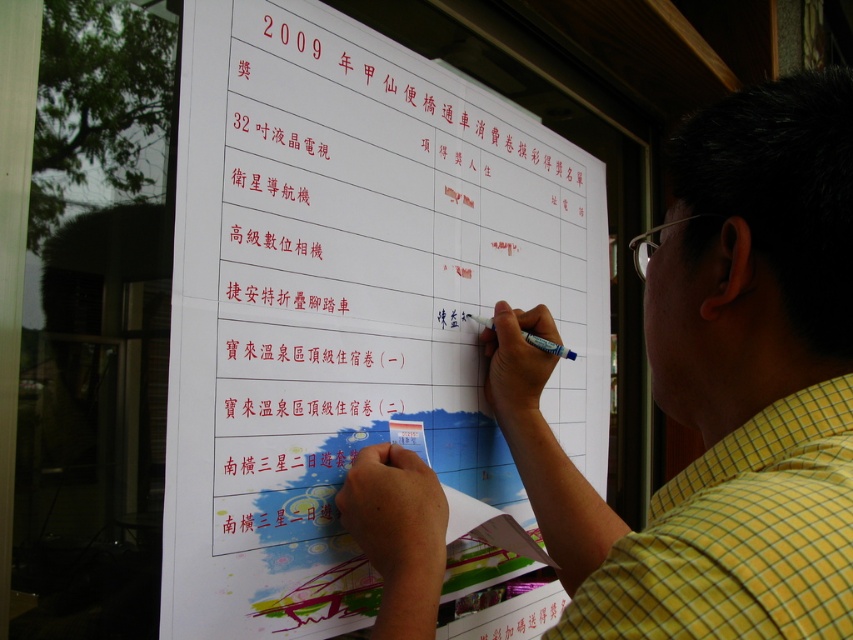
Who is positioned more to the left, white paper at center or yellow checkered shirt at upper right?

From the viewer's perspective, white paper at center appears more on the left side.

Who is lower down, white paper at center or yellow checkered shirt at upper right?

yellow checkered shirt at upper right is lower down.

Where is `white paper at center`? This screenshot has height=640, width=853. white paper at center is located at coordinates (352, 308).

Between point (827, 609) and point (813, 602), which one is positioned in front?

Point (827, 609) is in front.

Who is higher up, yellow checkered shirt at upper right or yellow checkered shirt at right?

yellow checkered shirt at upper right

Which is in front, point (624, 534) or point (798, 593)?

Point (798, 593) is in front.

At what (x,y) coordinates should I click in order to perform the action: click on yellow checkered shirt at upper right. Please return your answer as a coordinate pair (x, y). The image size is (853, 640). Looking at the image, I should click on (721, 388).

Does white paper at center have a larger size compared to yellow checkered shirt at right?

Indeed, white paper at center has a larger size compared to yellow checkered shirt at right.

Between point (469, 330) and point (746, 556), which one is positioned behind?

Point (469, 330)

Find the location of a particular element. This screenshot has height=640, width=853. white paper at center is located at coordinates pyautogui.click(x=352, y=308).